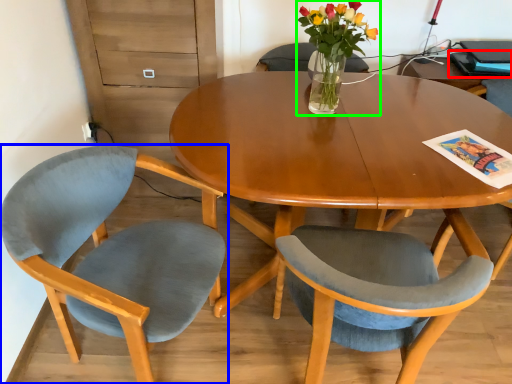
Question: Which object is the farthest from magazine (highlighted by a red box)? Choose among these: chair (highlighted by a blue box) or houseplant (highlighted by a green box).

Choices:
 (A) chair
 (B) houseplant

Answer: (A)